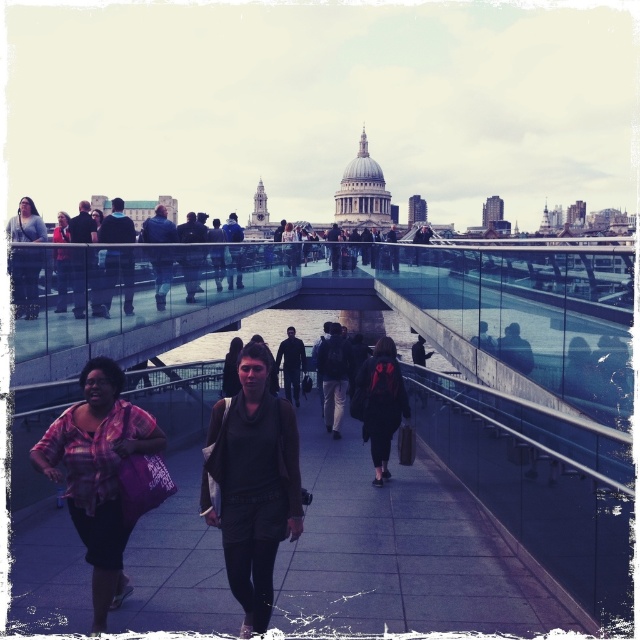
Question: Which point is closer to the camera?

Choices:
 (A) black matte jacket at center
 (B) dark gray sweater at center
 (C) matte black jacket at left
 (D) plaid fabric shirt at lower left

Answer: (D)

Question: Which point is farther from the camera taking this photo?

Choices:
 (A) (284, 481)
 (B) (68, 410)
 (C) (61, 227)
 (D) (156, 518)

Answer: (C)

Question: Where is plaid fabric shirt at lower left located in relation to matte pink shirt at left in the image?

Choices:
 (A) below
 (B) above

Answer: (A)

Question: Does matte black jacket at left appear over matte pink shirt at left?

Choices:
 (A) yes
 (B) no

Answer: (B)

Question: Which object appears closest to the camera in this image?

Choices:
 (A) plaid fabric shirt at lower left
 (B) matte pink shirt at left
 (C) matte black jacket at left
 (D) black matte jacket at center

Answer: (A)

Question: Is dark gray sweater at center bigger than matte pink shirt at left?

Choices:
 (A) no
 (B) yes

Answer: (A)